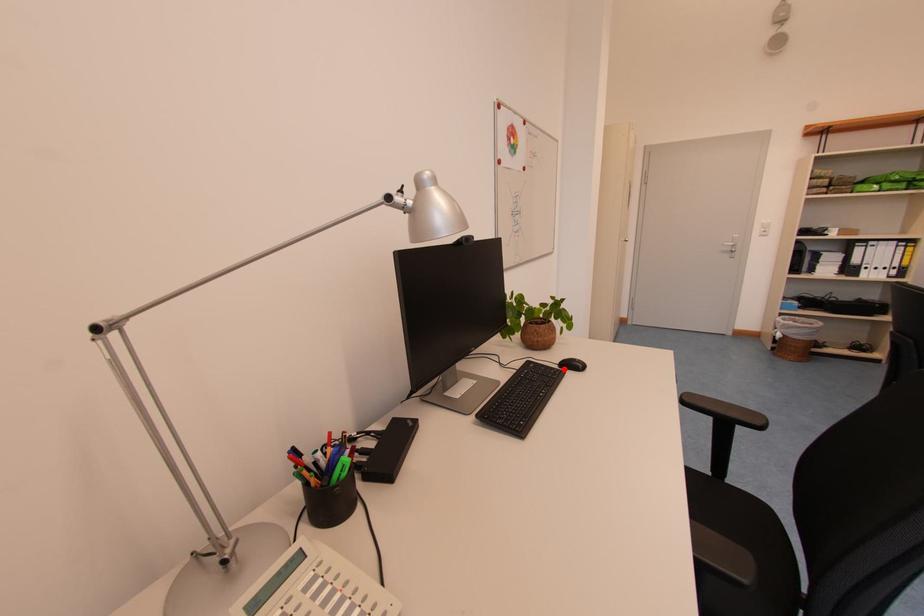
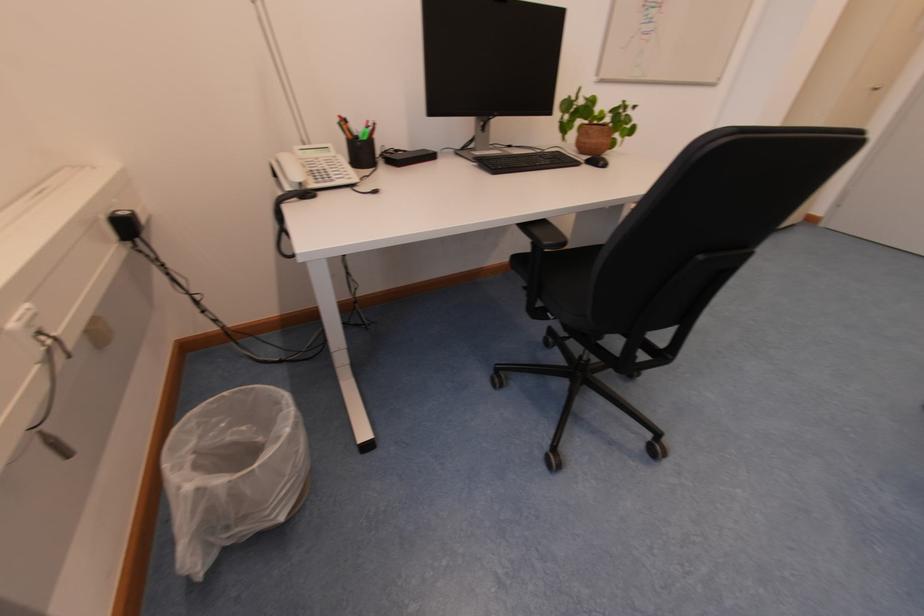
The point at the highlighted location is marked in the first image. Where is the corresponding point in the second image?

(590, 164)